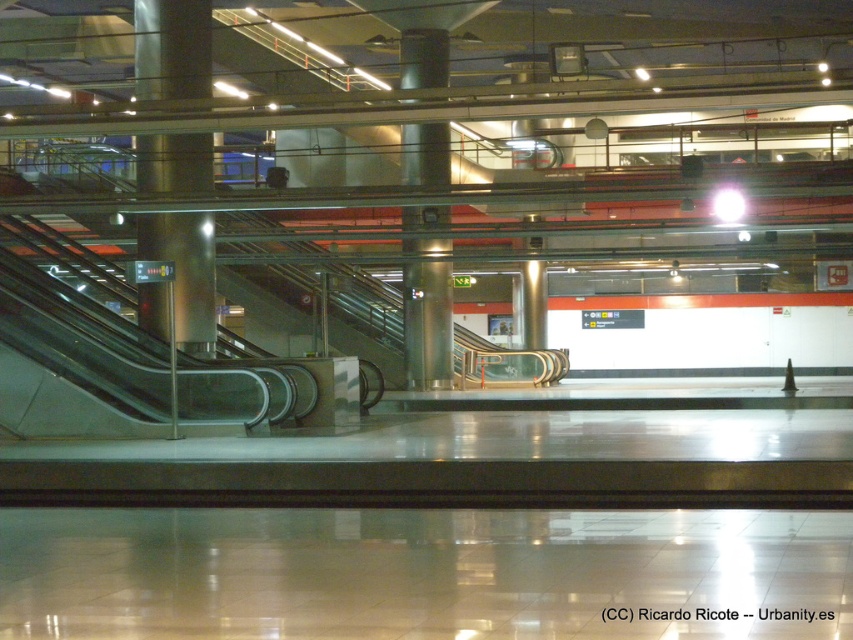
Question: Can you confirm if satin silver pillar at center is positioned below satin silver column at center?

Choices:
 (A) no
 (B) yes

Answer: (A)

Question: Which of the following is the farthest from the observer?

Choices:
 (A) satin silver pillar at center
 (B) satin silver column at center

Answer: (A)

Question: Is satin silver pillar at center thinner than satin silver column at center?

Choices:
 (A) no
 (B) yes

Answer: (B)

Question: Does satin silver pillar at center have a smaller size compared to satin silver column at center?

Choices:
 (A) no
 (B) yes

Answer: (B)